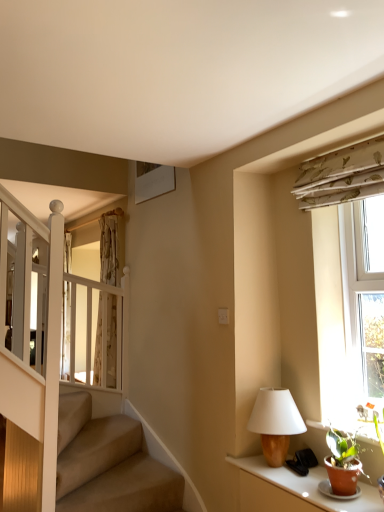
Question: Can you confirm if translucent fabric curtain at upper left is taller than matte brown table at lower right?

Choices:
 (A) no
 (B) yes

Answer: (B)

Question: From the image's perspective, is translucent fabric curtain at upper left under matte brown table at lower right?

Choices:
 (A) yes
 (B) no

Answer: (B)

Question: Is translucent fabric curtain at upper left positioned with its back to matte brown table at lower right?

Choices:
 (A) no
 (B) yes

Answer: (A)

Question: From the image's perspective, is translucent fabric curtain at upper left above matte brown table at lower right?

Choices:
 (A) no
 (B) yes

Answer: (B)

Question: Can you confirm if translucent fabric curtain at upper left is thinner than matte brown table at lower right?

Choices:
 (A) no
 (B) yes

Answer: (B)

Question: Considering the positions of white textured window at right and floral fabric curtain at upper right in the image, is white textured window at right taller or shorter than floral fabric curtain at upper right?

Choices:
 (A) short
 (B) tall

Answer: (B)

Question: Relative to floral fabric curtain at upper right, is white textured window at right in front or behind?

Choices:
 (A) front
 (B) behind

Answer: (B)

Question: From a real-world perspective, is white textured window at right above or below floral fabric curtain at upper right?

Choices:
 (A) below
 (B) above

Answer: (A)

Question: Is white textured window at right to the left or to the right of floral fabric curtain at upper right in the image?

Choices:
 (A) right
 (B) left

Answer: (A)

Question: From a real-world perspective, relative to matte brown table at lower right, is floral fabric curtain at upper right vertically above or below?

Choices:
 (A) above
 (B) below

Answer: (A)

Question: Is point (372, 143) closer or farther from the camera than point (326, 501)?

Choices:
 (A) farther
 (B) closer

Answer: (A)

Question: From their relative heights in the image, would you say floral fabric curtain at upper right is taller or shorter than matte brown table at lower right?

Choices:
 (A) tall
 (B) short

Answer: (A)

Question: Which is correct: floral fabric curtain at upper right is inside matte brown table at lower right, or outside of it?

Choices:
 (A) outside
 (B) inside

Answer: (A)

Question: Does point (332, 350) appear closer or farther from the camera than point (258, 407)?

Choices:
 (A) farther
 (B) closer

Answer: (A)

Question: Visually, is white textured window at right positioned to the left or to the right of wooden table lamp at right?

Choices:
 (A) right
 (B) left

Answer: (A)